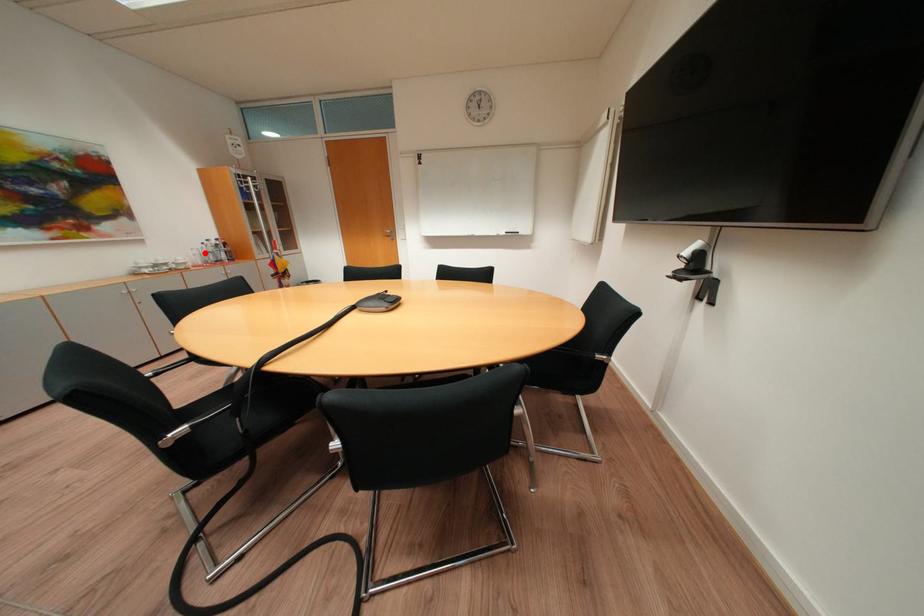
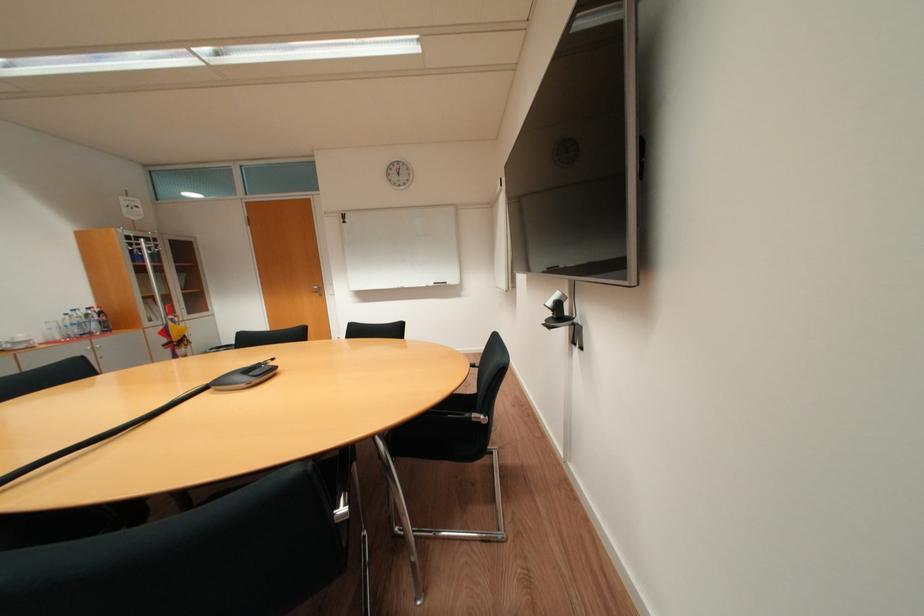
Question: I am providing you with two images of the same scene from different viewpoints. In image1, a red point is highlighted. Considering the same 3D point in image2, which of the following is correct?

Choices:
 (A) It is closer
 (B) It is farther

Answer: (B)